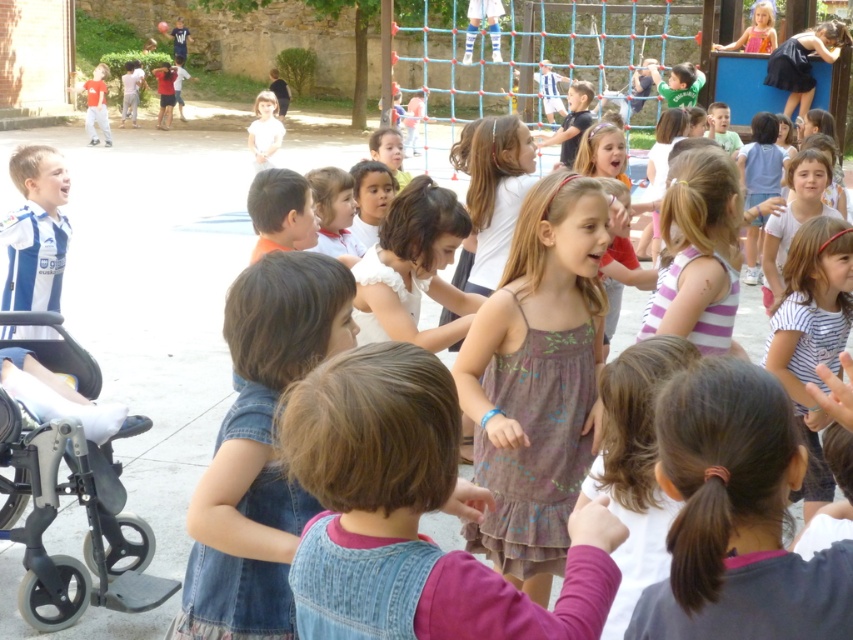
Question: Can you confirm if brown textured dress at center is bigger than gray metallic baby carriage at lower left?

Choices:
 (A) yes
 (B) no

Answer: (B)

Question: Is brown textured dress at center to the right of pink fabric dress at upper right from the viewer's perspective?

Choices:
 (A) yes
 (B) no

Answer: (B)

Question: Does brown textured dress at center appear on the left side of pink fabric dress at upper right?

Choices:
 (A) yes
 (B) no

Answer: (A)

Question: Which point is farther to the camera?

Choices:
 (A) (515, 387)
 (B) (96, 448)

Answer: (B)

Question: Which of these objects is positioned farthest from the brown textured dress at center?

Choices:
 (A) gray metallic baby carriage at lower left
 (B) pink fabric dress at upper right

Answer: (B)

Question: Which object is farther from the camera taking this photo?

Choices:
 (A) brown textured dress at center
 (B) pink fabric dress at upper right

Answer: (B)